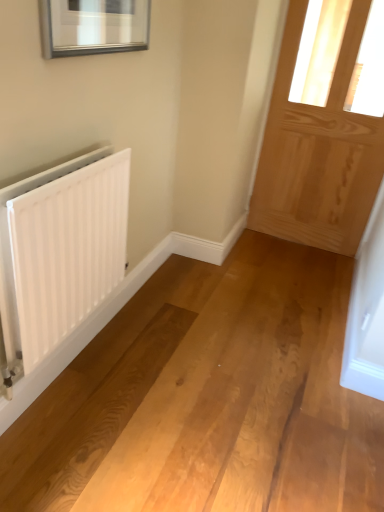
The height and width of the screenshot is (512, 384). Find the location of `free point below natural wood door at right (from a real-world perspective)`. free point below natural wood door at right (from a real-world perspective) is located at coordinates (310, 245).